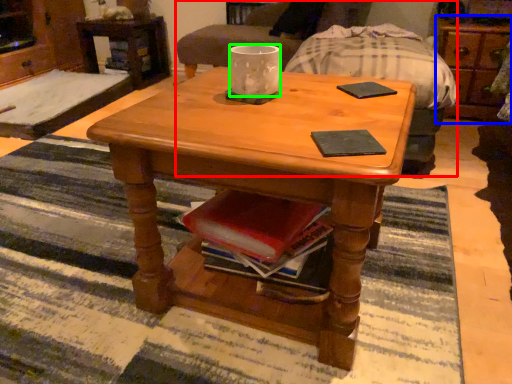
Question: Which object is positioned farthest from armchair (highlighted by a red box)? Select from dresser (highlighted by a blue box) and coffee cup (highlighted by a green box).

Choices:
 (A) dresser
 (B) coffee cup

Answer: (B)